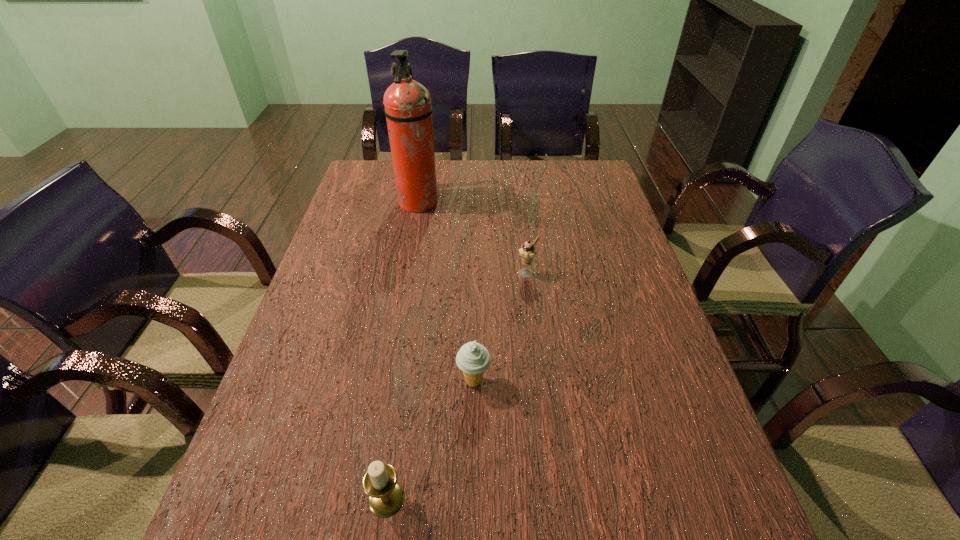
Locate an element on the screen. Image resolution: width=960 pixels, height=540 pixels. free space that is in between the candle holder and the fire extinguisher is located at coordinates (402, 350).

Where is `vacant area that lies between the left icecream and the nearest object`? This screenshot has height=540, width=960. vacant area that lies between the left icecream and the nearest object is located at coordinates (430, 440).

Locate an element on the screen. The image size is (960, 540). vacant area between the candle holder and the rightmost object is located at coordinates (457, 386).

Identify the location of free point between the farthest object and the candle holder. (402, 350).

The height and width of the screenshot is (540, 960). In order to click on vacant area that lies between the nearer icecream and the candle holder in this screenshot , I will do `click(430, 440)`.

Find the location of `empty location between the third farthest object and the nearest object`. empty location between the third farthest object and the nearest object is located at coordinates (430, 440).

You are a GUI agent. You are given a task and a screenshot of the screen. Output one action in this format:
    pyautogui.click(x=<x>, y=<y>)
    Task: Click on the vacant space that's between the right icecream and the nearest object
    The width and height of the screenshot is (960, 540).
    Given the screenshot: What is the action you would take?
    pyautogui.click(x=457, y=386)

Identify the location of object that is the second closest one to the candle holder. Image resolution: width=960 pixels, height=540 pixels. (527, 252).

Identify which object is the second nearest to the second nearest object. Please provide its 2D coordinates. Your answer should be formatted as a tuple, i.e. [(x, y)], where the tuple contains the x and y coordinates of a point satisfying the conditions above.

[(527, 252)]

The image size is (960, 540). In order to click on free space in the image that satisfies the following two spatial constraints: 1. at the nozzle of the farthest object; 2. on the right side of the candle holder in this screenshot , I will do `click(364, 498)`.